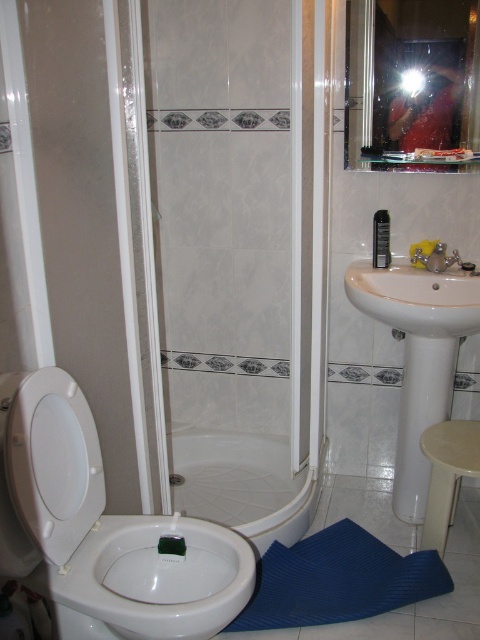
Is point (408, 387) in front of point (308, 504)?

That is False.

Locate an element on the screen. white ceramic sink at right is located at coordinates (418, 356).

Is white glossy shower door at center bigger than transparent plastic screen door at left?

Yes.

Can you confirm if white glossy shower door at center is smaller than transparent plastic screen door at left?

No.

Locate an element on the screen. The image size is (480, 640). white glossy shower door at center is located at coordinates (239, 252).

I want to click on white glossy shower door at center, so click(x=239, y=252).

Is white glossy bidet at lower left below yellow matte faucet at upper right?

Indeed, white glossy bidet at lower left is positioned under yellow matte faucet at upper right.

Between point (232, 540) and point (432, 257), which one is positioned behind?

Positioned behind is point (432, 257).

Identify the location of white glossy bidet at lower left. This screenshot has width=480, height=640. (152, 579).